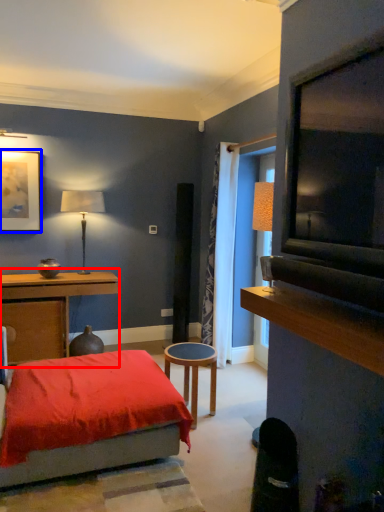
Question: Which object appears closest to the camera in this image, table (highlighted by a red box) or picture frame (highlighted by a blue box)?

Choices:
 (A) table
 (B) picture frame

Answer: (A)